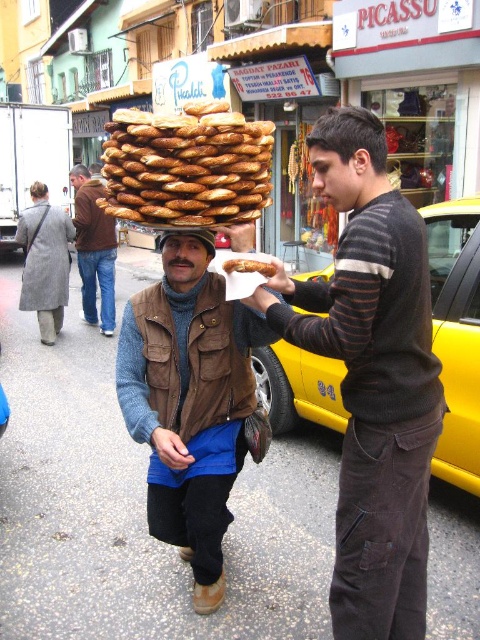
Between point (79, 163) and point (180, 248), which one is positioned behind?

The point (79, 163) is more distant.

Can you confirm if brown leather jacket at center is bigger than brown leather hat at center?

Yes.

Locate an element on the screen. The height and width of the screenshot is (640, 480). brown leather jacket at center is located at coordinates (94, 250).

Can you confirm if golden brown bread at center is smaller than dark brown hair at upper left?

Indeed, golden brown bread at center has a smaller size compared to dark brown hair at upper left.

Who is positioned more to the right, golden brown bread at center or dark brown hair at upper left?

Positioned to the right is golden brown bread at center.

Which is behind, point (237, 266) or point (40, 186)?

Point (40, 186)

I want to click on golden brown bread at center, so click(x=249, y=266).

How much distance is there between brown leather cap at center and dark brown hair at upper left?

They are 21.87 inches apart.

Is brown leather cap at center shorter than dark brown hair at upper left?

In fact, brown leather cap at center may be taller than dark brown hair at upper left.

Consider the image. Who is more distant from viewer, [81,182] or [41,186]?

The point [81,182] is behind.

This screenshot has width=480, height=640. Identify the location of brown leather cap at center. (79, 176).